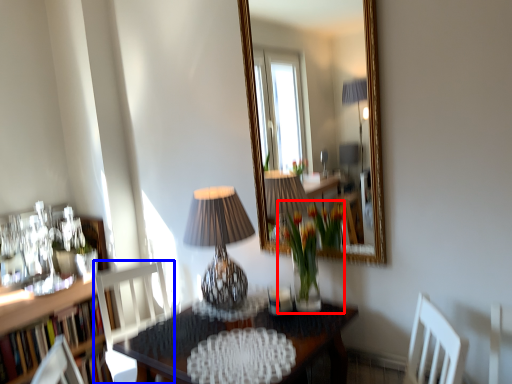
Question: Which object appears closest to the camera in this image, floral arrangement (highlighted by a red box) or chair (highlighted by a blue box)?

Choices:
 (A) floral arrangement
 (B) chair

Answer: (A)